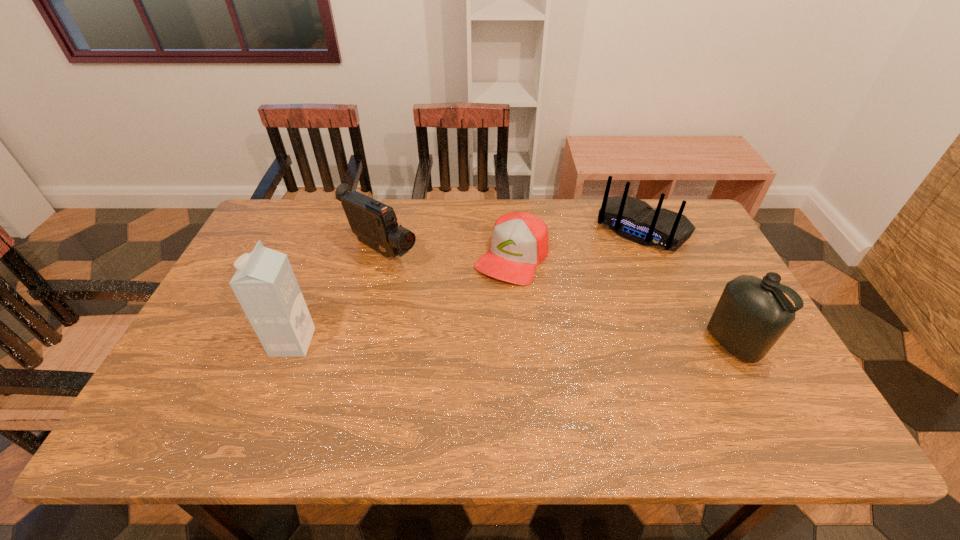
At what (x,y) coordinates should I click in order to perform the action: click on free space located on the back of the router. Please return your answer as a coordinate pair (x, y). This screenshot has height=540, width=960. Looking at the image, I should click on (599, 284).

Where is `vacant space located on the front-facing side of the shortest object`? This screenshot has height=540, width=960. vacant space located on the front-facing side of the shortest object is located at coordinates (481, 309).

Find the location of a particular element. The image size is (960, 540). free space located on the front-facing side of the shortest object is located at coordinates (436, 381).

Where is `free space located on the front-facing side of the shortest object`? Image resolution: width=960 pixels, height=540 pixels. free space located on the front-facing side of the shortest object is located at coordinates (459, 344).

Where is `vacant region located on the front-facing side of the camcorder`? vacant region located on the front-facing side of the camcorder is located at coordinates (441, 287).

You are a GUI agent. You are given a task and a screenshot of the screen. Output one action in this format:
    pyautogui.click(x=<x>, y=<y>)
    Task: Click on the free region located on the front-facing side of the camcorder
    Image resolution: width=960 pixels, height=540 pixels.
    Given the screenshot: What is the action you would take?
    pyautogui.click(x=478, y=310)

Find the location of a particular element. free location located on the front-facing side of the camcorder is located at coordinates (441, 287).

Where is `router that is at the far edge`? router that is at the far edge is located at coordinates (635, 220).

This screenshot has width=960, height=540. I want to click on baseball cap located in the far edge section of the desktop, so click(x=519, y=242).

Where is `camcorder located at the far edge`? camcorder located at the far edge is located at coordinates (375, 224).